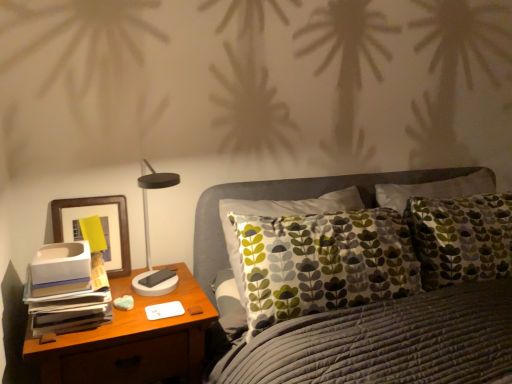
Question: Considering the relative sizes of matte black table lamp at left and wooden nightstand at left in the image provided, is matte black table lamp at left wider than wooden nightstand at left?

Choices:
 (A) no
 (B) yes

Answer: (A)

Question: Is matte black table lamp at left bigger than wooden nightstand at left?

Choices:
 (A) yes
 (B) no

Answer: (B)

Question: Is matte black table lamp at left at the left side of wooden nightstand at left?

Choices:
 (A) no
 (B) yes

Answer: (A)

Question: Considering the relative sizes of matte black table lamp at left and wooden nightstand at left in the image provided, is matte black table lamp at left shorter than wooden nightstand at left?

Choices:
 (A) no
 (B) yes

Answer: (B)

Question: Would you say matte black table lamp at left is outside wooden nightstand at left?

Choices:
 (A) no
 (B) yes

Answer: (B)

Question: From the image's perspective, is matte black table lamp at left positioned above or below wooden nightstand at left?

Choices:
 (A) below
 (B) above

Answer: (B)

Question: From their relative heights in the image, would you say matte black table lamp at left is taller or shorter than wooden nightstand at left?

Choices:
 (A) short
 (B) tall

Answer: (A)

Question: From a real-world perspective, is matte black table lamp at left physically located above or below wooden nightstand at left?

Choices:
 (A) below
 (B) above

Answer: (B)

Question: Considering the positions of matte black table lamp at left and wooden nightstand at left in the image, is matte black table lamp at left wider or thinner than wooden nightstand at left?

Choices:
 (A) wide
 (B) thin

Answer: (B)

Question: From the image's perspective, relative to wooden picture frame at left, is matte black table lamp at left above or below?

Choices:
 (A) below
 (B) above

Answer: (B)

Question: Is matte black table lamp at left spatially inside wooden picture frame at left, or outside of it?

Choices:
 (A) inside
 (B) outside

Answer: (B)

Question: From their relative heights in the image, would you say matte black table lamp at left is taller or shorter than wooden picture frame at left?

Choices:
 (A) short
 (B) tall

Answer: (B)

Question: From a real-world perspective, is matte black table lamp at left above or below wooden picture frame at left?

Choices:
 (A) above
 (B) below

Answer: (A)

Question: From a real-world perspective, is wooden nightstand at left physically located above or below matte black table lamp at left?

Choices:
 (A) below
 (B) above

Answer: (A)

Question: Is wooden nightstand at left in front of or behind matte black table lamp at left in the image?

Choices:
 (A) front
 (B) behind

Answer: (A)